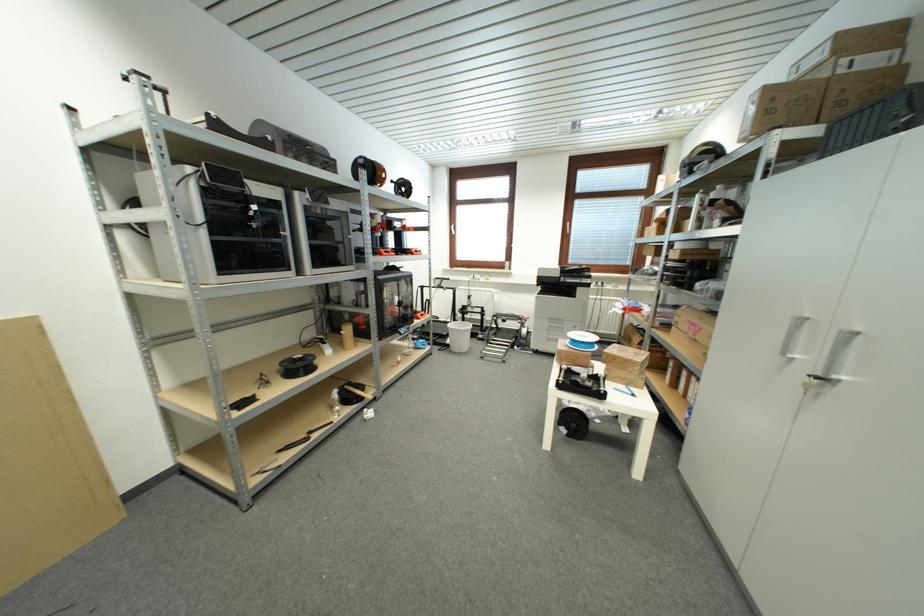
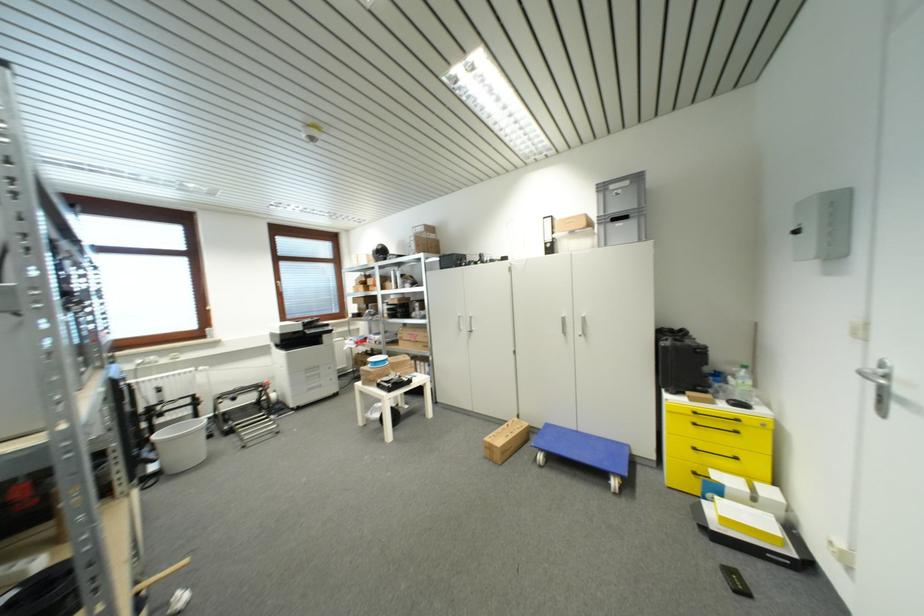
The point at (811, 361) is marked in the first image. Where is the corresponding point in the second image?

(468, 330)